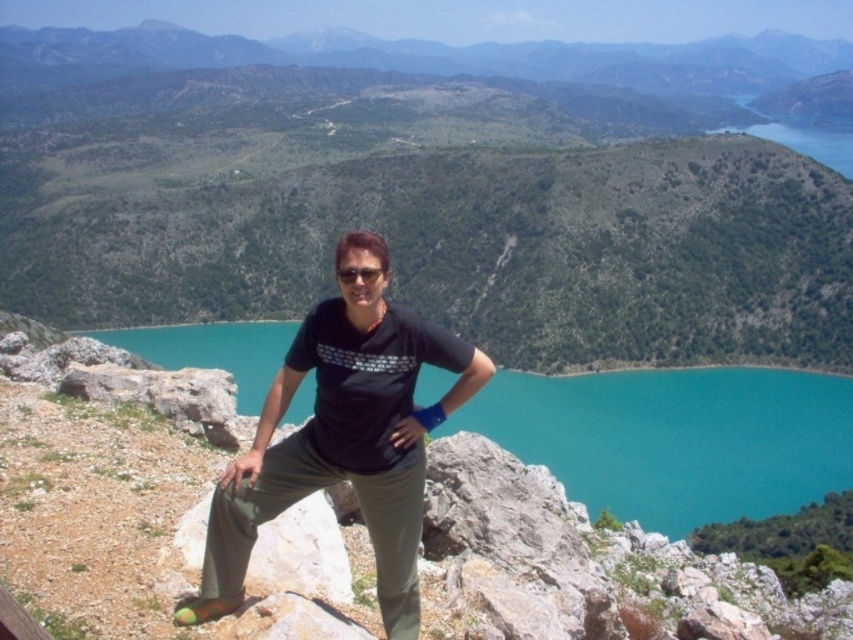
Who is higher up, turquoise glossy water at center or matte black t-shirt at center?

Positioned higher is matte black t-shirt at center.

Is turquoise glossy water at center to the left of matte black t-shirt at center from the viewer's perspective?

Correct, you'll find turquoise glossy water at center to the left of matte black t-shirt at center.

Between point (668, 476) and point (383, 557), which one is positioned behind?

Positioned behind is point (668, 476).

At what (x,y) coordinates should I click in order to perform the action: click on turquoise glossy water at center. Please return your answer as a coordinate pair (x, y). This screenshot has width=853, height=640. Looking at the image, I should click on (675, 438).